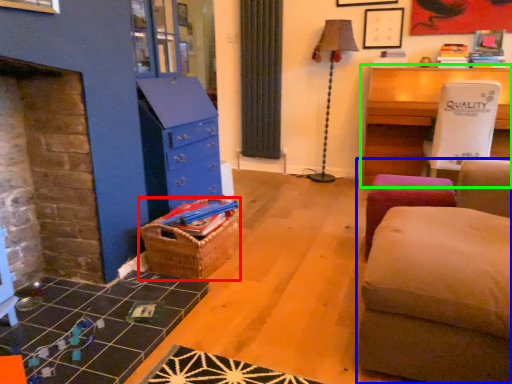
Question: Which object is the closest to the crate (highlighted by a red box)? Choose among these: studio couch (highlighted by a blue box) or table (highlighted by a green box).

Choices:
 (A) studio couch
 (B) table

Answer: (A)